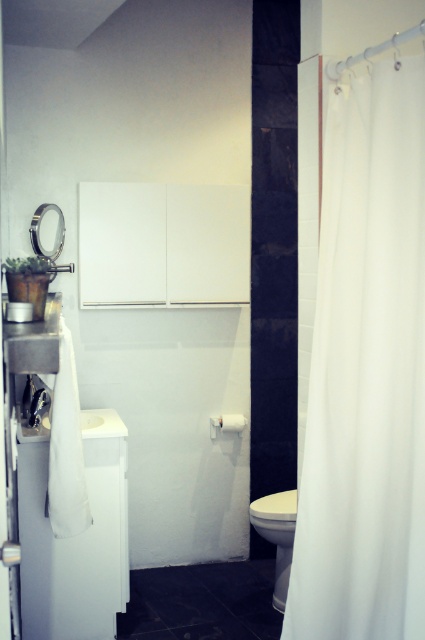
You are standing in the bathroom and want to place a new decorative item between the white fabric shower curtain at right and the white glossy toilet bowl at lower center. Based on their positions, which object should you place it closer to if you want it to be more towards the right side of the bathroom?

The white fabric shower curtain at right is positioned on the right side of the white glossy toilet bowl at lower center, so placing the decorative item closer to the shower curtain would position it more towards the right side of the bathroom.

You are standing in the bathroom and want to reach the white fabric shower curtain at right. Based on the room layout described, where should you move to in order to get to it?

The white fabric shower curtain at right is located at the point with coordinates 0.581 on the x axis and 0.861 on the y axis, so you should move towards the right side of the bathroom to reach it.